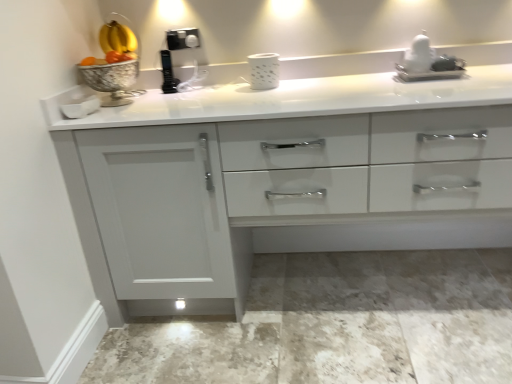
This screenshot has width=512, height=384. Describe the element at coordinates (283, 180) in the screenshot. I see `white glossy countertop at center` at that location.

Identify the location of white glossy countertop at center. The height and width of the screenshot is (384, 512). (283, 180).

Describe the element at coordinates (428, 63) in the screenshot. I see `white glossy statue at upper right` at that location.

Locate an element on the screen. white glossy statue at upper right is located at coordinates (428, 63).

I want to click on white glossy countertop at center, so click(283, 180).

Based on their positions, is white glossy statue at upper right located to the left or right of white glossy countertop at center?

Based on their positions, white glossy statue at upper right is located to the right of white glossy countertop at center.

Between white glossy statue at upper right and white glossy countertop at center, which one is positioned behind?

white glossy statue at upper right is further from the camera.

Which is farther from the camera, (457,74) or (323,169)?

Positioned behind is point (457,74).

From the image's perspective, would you say white glossy statue at upper right is positioned over white glossy countertop at center?

Yes.

From a real-world perspective, is white glossy statue at upper right beneath white glossy countertop at center?

No.

Between white glossy statue at upper right and white glossy countertop at center, which one has smaller width?

With smaller width is white glossy statue at upper right.

Is white glossy statue at upper right shorter than white glossy countertop at center?

Yes.

Does white glossy statue at upper right have a larger size compared to white glossy countertop at center?

No.

From the picture: Which is correct: white glossy statue at upper right is inside white glossy countertop at center, or outside of it?

white glossy statue at upper right is inside white glossy countertop at center.

Are white glossy statue at upper right and white glossy countertop at center making contact?

white glossy statue at upper right and white glossy countertop at center are clearly separated.

Is white glossy statue at upper right oriented towards white glossy countertop at center?

Yes, white glossy statue at upper right is oriented towards white glossy countertop at center.

The width and height of the screenshot is (512, 384). I want to click on sink that is behind the white glossy countertop at center, so click(428, 63).

Can you confirm if white glossy countertop at center is positioned to the left of white glossy statue at upper right?

Yes, white glossy countertop at center is to the left of white glossy statue at upper right.

Is white glossy countertop at center positioned in front of white glossy statue at upper right?

Yes, white glossy countertop at center is in front of white glossy statue at upper right.

Which point is more distant from viewer, (79, 153) or (406, 58)?

Point (406, 58)

From the image's perspective, which is below, white glossy countertop at center or white glossy statue at upper right?

white glossy countertop at center, from the image's perspective.

From a real-world perspective, which is physically below, white glossy countertop at center or white glossy statue at upper right?

white glossy countertop at center is physically lower.

Considering the relative sizes of white glossy countertop at center and white glossy statue at upper right in the image provided, is white glossy countertop at center wider than white glossy statue at upper right?

Yes, white glossy countertop at center is wider than white glossy statue at upper right.

Who is taller, white glossy countertop at center or white glossy statue at upper right?

white glossy countertop at center is taller.

In terms of size, does white glossy countertop at center appear bigger or smaller than white glossy statue at upper right?

In the image, white glossy countertop at center appears to be larger than white glossy statue at upper right.

In the scene shown: Is white glossy countertop at center inside or outside of white glossy statue at upper right?

white glossy countertop at center is located beyond the bounds of white glossy statue at upper right.

Is white glossy countertop at center beside white glossy statue at upper right?

No, white glossy countertop at center is not beside white glossy statue at upper right.

Is white glossy countertop at center facing away from white glossy statue at upper right?

white glossy countertop at center is not turned away from white glossy statue at upper right.

What's the angular difference between white glossy countertop at center and white glossy statue at upper right's facing directions?

The facing directions of white glossy countertop at center and white glossy statue at upper right are 0.635 degrees apart.

Where is `countertop below the white glossy statue at upper right (from the image's perspective)`? countertop below the white glossy statue at upper right (from the image's perspective) is located at coordinates [283, 180].

I want to click on sink located above the white glossy countertop at center (from the image's perspective), so click(x=428, y=63).

Where is `countertop below the white glossy statue at upper right (from a real-world perspective)`? The image size is (512, 384). countertop below the white glossy statue at upper right (from a real-world perspective) is located at coordinates (283, 180).